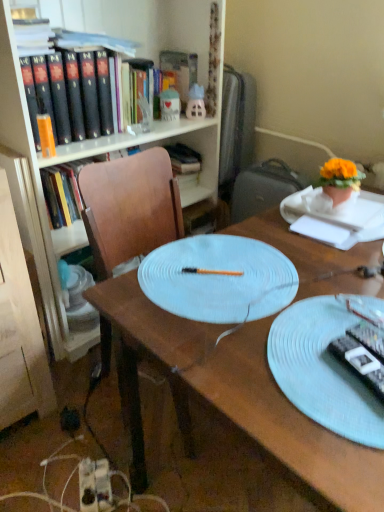
Identify the location of blank space to the left of black plastic remote control at lower right, which appears as the second remote control when viewed from the right. The width and height of the screenshot is (384, 512). (283, 374).